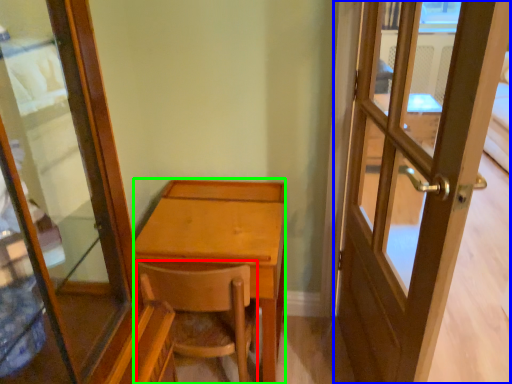
Question: Which object is the closest to the chair (highlighted by a red box)? Choose among these: door (highlighted by a blue box) or desk (highlighted by a green box).

Choices:
 (A) door
 (B) desk

Answer: (B)